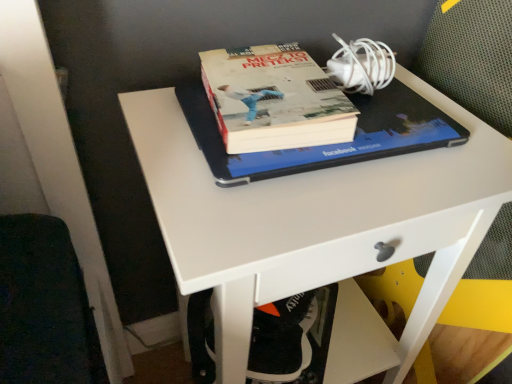
Question: Would you consider white plastic swivel chair at lower center to be distant from hardcover book at center?

Choices:
 (A) no
 (B) yes

Answer: (A)

Question: Are white plastic swivel chair at lower center and hardcover book at center making contact?

Choices:
 (A) no
 (B) yes

Answer: (A)

Question: From the image's perspective, is white plastic swivel chair at lower center above hardcover book at center?

Choices:
 (A) yes
 (B) no

Answer: (B)

Question: Can you confirm if white plastic swivel chair at lower center is positioned to the left of hardcover book at center?

Choices:
 (A) yes
 (B) no

Answer: (A)

Question: Can you confirm if white plastic swivel chair at lower center is wider than hardcover book at center?

Choices:
 (A) no
 (B) yes

Answer: (A)

Question: Considering the positions of hardcover book at center and hardcover book at center in the image, is hardcover book at center taller or shorter than hardcover book at center?

Choices:
 (A) short
 (B) tall

Answer: (B)

Question: In terms of width, does hardcover book at center look wider or thinner when compared to hardcover book at center?

Choices:
 (A) wide
 (B) thin

Answer: (B)

Question: Is hardcover book at center inside or outside of hardcover book at center?

Choices:
 (A) inside
 (B) outside

Answer: (B)

Question: From a real-world perspective, is hardcover book at center above or below hardcover book at center?

Choices:
 (A) above
 (B) below

Answer: (A)

Question: Is hardcover book at center in front of or behind white matte desk at center in the image?

Choices:
 (A) front
 (B) behind

Answer: (B)

Question: From the image's perspective, relative to white matte desk at center, is hardcover book at center above or below?

Choices:
 (A) below
 (B) above

Answer: (B)

Question: Considering the positions of point (283, 129) and point (267, 284), is point (283, 129) closer or farther from the camera than point (267, 284)?

Choices:
 (A) closer
 (B) farther

Answer: (A)

Question: In terms of width, does hardcover book at center look wider or thinner when compared to white matte desk at center?

Choices:
 (A) wide
 (B) thin

Answer: (B)

Question: Relative to white plastic swivel chair at lower center, is hardcover book at center in front or behind?

Choices:
 (A) front
 (B) behind

Answer: (A)

Question: Considering the positions of hardcover book at center and white plastic swivel chair at lower center in the image, is hardcover book at center wider or thinner than white plastic swivel chair at lower center?

Choices:
 (A) wide
 (B) thin

Answer: (A)